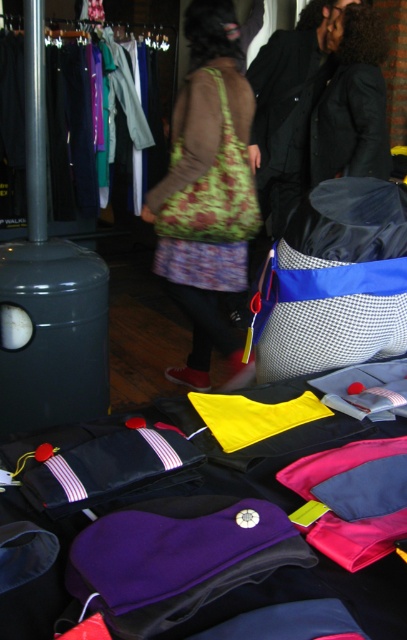
Question: Which point is closer to the camera?

Choices:
 (A) (216, 282)
 (B) (312, 122)
 (C) (183, 189)
 (D) (295, 150)

Answer: (C)

Question: Which is nearer to the black leather jacket at upper right?

Choices:
 (A) black wool coat at upper right
 (B) green textured bag at center

Answer: (A)

Question: Does blue and white checkered bag at center have a lesser width compared to floral fabric bag at center?

Choices:
 (A) no
 (B) yes

Answer: (B)

Question: Based on their relative distances, which object is farther from the black leather jacket at upper right?

Choices:
 (A) floral fabric bag at center
 (B) green textured bag at center

Answer: (B)

Question: Is blue and white checkered bag at center wider than green textured bag at center?

Choices:
 (A) no
 (B) yes

Answer: (A)

Question: Is blue and white checkered bag at center below floral fabric bag at center?

Choices:
 (A) no
 (B) yes

Answer: (B)